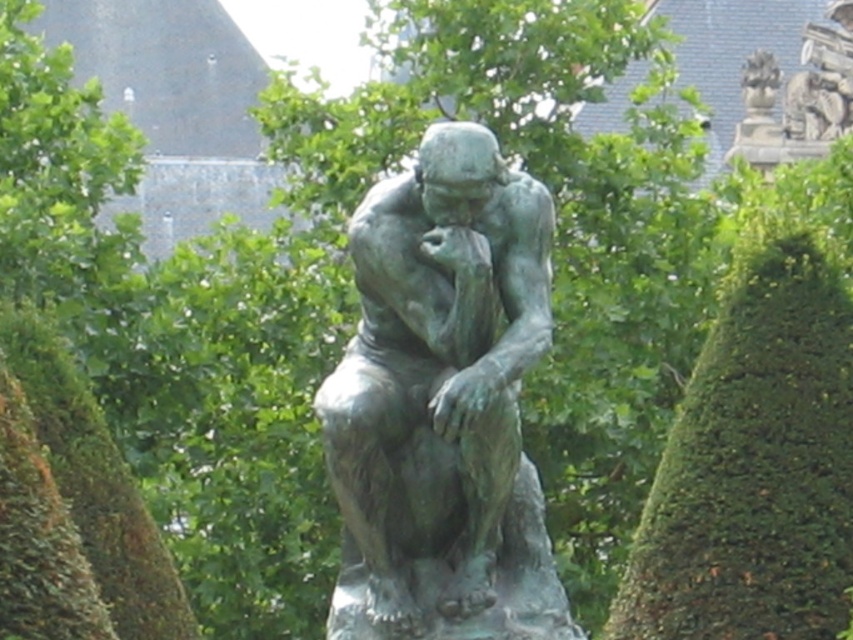
Question: Which of the following is the closest to the observer?

Choices:
 (A) (529, 218)
 (B) (850, 118)

Answer: (A)

Question: Which point is farther to the camera?

Choices:
 (A) bronze statue at upper right
 (B) bronze statue at center

Answer: (A)

Question: Is bronze statue at center to the right of bronze statue at upper right from the viewer's perspective?

Choices:
 (A) yes
 (B) no

Answer: (B)

Question: Which object is farther from the camera taking this photo?

Choices:
 (A) bronze statue at center
 (B) bronze statue at upper right

Answer: (B)

Question: Observing the image, what is the correct spatial positioning of bronze statue at center in reference to bronze statue at upper right?

Choices:
 (A) right
 (B) left

Answer: (B)

Question: Is bronze statue at center above bronze statue at upper right?

Choices:
 (A) yes
 (B) no

Answer: (B)